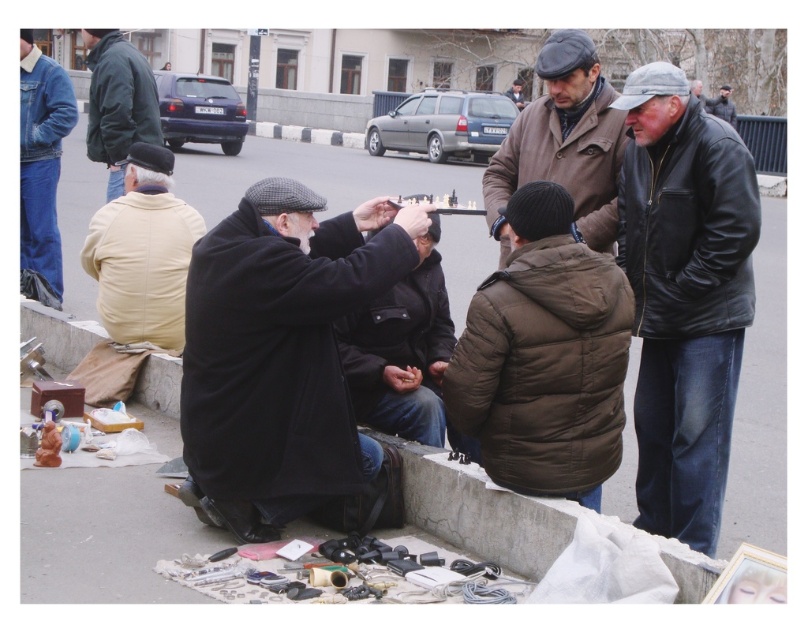
You are a delivery person who needs to place a small package on the concrete pavement at center. However, there is a light beige jacket at left nearby. According to the scene description, where exactly should you position the package so it doesn

The concrete pavement at center is in front of the light beige jacket at left, so you should place the package on the concrete pavement at center in front of the light beige jacket at left to ensure it is visible and not obstructed by the jacket.